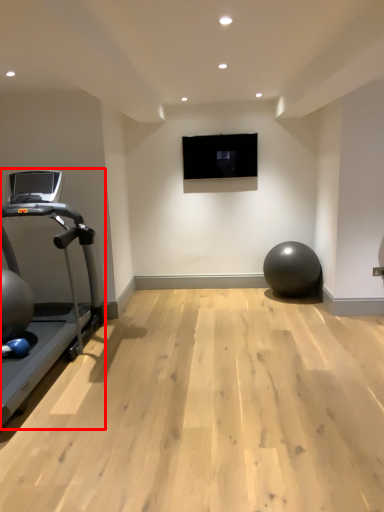
Question: From the image's perspective, what is the correct spatial positioning of treadmill (annotated by the red box) in reference to ball?

Choices:
 (A) above
 (B) below

Answer: (A)